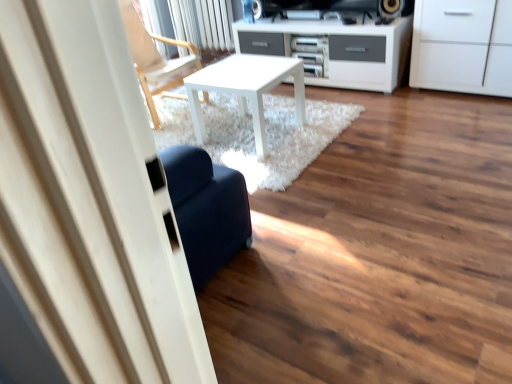
Question: Looking at the image, does white matte cabinet at upper right seem bigger or smaller compared to white matte table at center?

Choices:
 (A) small
 (B) big

Answer: (B)

Question: Which is correct: white matte cabinet at upper right is inside white matte table at center, or outside of it?

Choices:
 (A) outside
 (B) inside

Answer: (A)

Question: Based on their relative distances, which object is nearer to the wooden chair at upper left?

Choices:
 (A) white matte table at center
 (B) white matte cabinet at upper right

Answer: (A)

Question: Considering the real-world distances, which object is closest to the white matte table at center?

Choices:
 (A) white matte cabinet at upper right
 (B) wooden chair at upper left

Answer: (B)